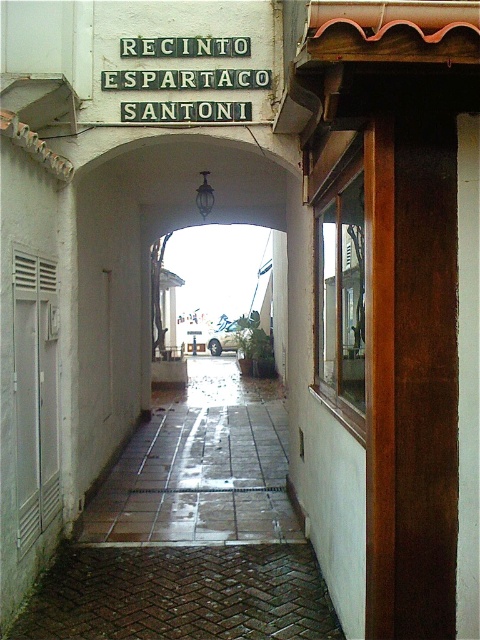
Question: Among these objects, which one is nearest to the camera?

Choices:
 (A) green metal sign at upper center
 (B) wet brick pavement at center
 (C) brown tile pavement at center

Answer: (B)

Question: Does wet brick pavement at center have a smaller size compared to brown tile pavement at center?

Choices:
 (A) no
 (B) yes

Answer: (B)

Question: Which point is closer to the camera taking this photo?

Choices:
 (A) (265, 636)
 (B) (248, 454)
 (C) (216, 339)

Answer: (A)

Question: Estimate the real-world distances between objects in this image. Which object is closer to the brown tile pavement at center?

Choices:
 (A) green metal sign at upper center
 (B) wet brick pavement at center
 (C) metallic silver car at center

Answer: (B)

Question: Is wet brick pavement at center below metallic silver car at center?

Choices:
 (A) no
 (B) yes

Answer: (B)

Question: Considering the relative positions of brown tile pavement at center and green metal sign at upper center in the image provided, where is brown tile pavement at center located with respect to green metal sign at upper center?

Choices:
 (A) above
 (B) below

Answer: (B)